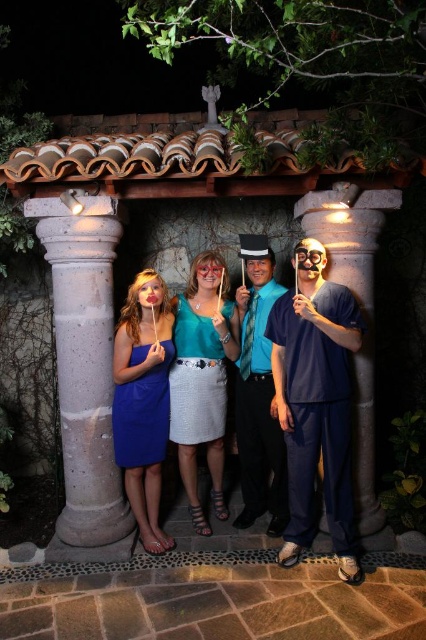
Question: Which object is the closest to the matte pink lips at center?

Choices:
 (A) speckled concrete column at left
 (B) matte teal dress at center

Answer: (B)

Question: Can you confirm if teal fabric skirt at center is wider than matte pink lips at center?

Choices:
 (A) no
 (B) yes

Answer: (B)

Question: Among these points, which one is nearest to the camera?

Choices:
 (A) (256, 288)
 (B) (316, 262)
 (C) (187, 355)

Answer: (B)

Question: Estimate the real-world distances between objects in this image. Which object is closer to the teal fabric skirt at center?

Choices:
 (A) speckled concrete column at left
 (B) matte blue dress at left
 (C) matte pink lips at center
 (D) matte gold mask at center

Answer: (B)

Question: Is matte blue dress at left above matte teal dress at center?

Choices:
 (A) yes
 (B) no

Answer: (B)

Question: Can you confirm if matte teal dress at center is bigger than blue satin tie at center?

Choices:
 (A) no
 (B) yes

Answer: (A)